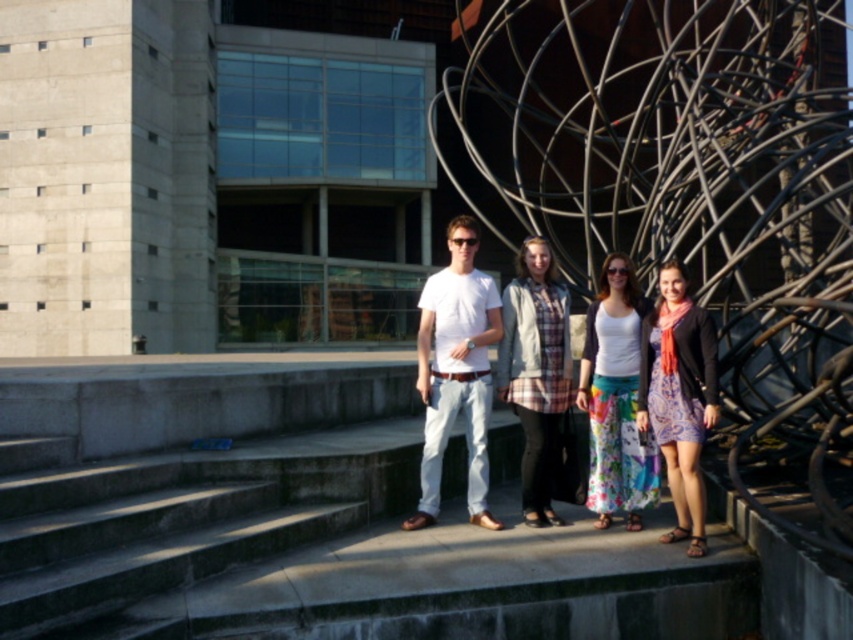
You are a photographer taking a picture of the group standing on the steps. You notice the white cotton tank top at center and the plaid fabric shirt at center. Which person should you adjust to ensure both shirts are centered in the frame?

The white cotton tank top at center is to the right of the plaid fabric shirt at center. To center both shirts, move the person wearing the white cotton tank top at center slightly to the left so it aligns with the plaid fabric shirt at center.

Looking at this image, you are organizing a clothing display and need to arrange the patterned fabric dress at center and the plaid fabric shirt at center on a rack. Which item should you place first if you want to ensure the thinner item is visible behind the thicker one?

The patterned fabric dress at center is thinner than the plaid fabric shirt at center, so you should place the plaid fabric shirt at center in front to allow the thinner dress to be visible behind.